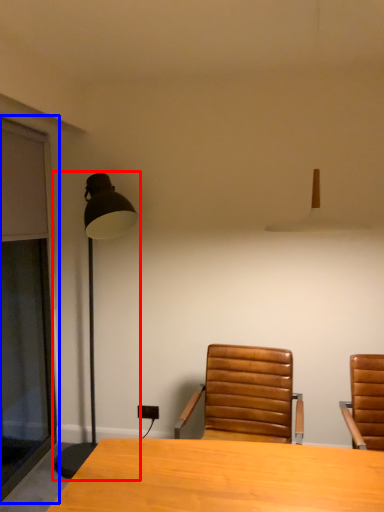
Question: Which of the following is the farthest to the observer, lamp (highlighted by a red box) or screen door (highlighted by a blue box)?

Choices:
 (A) lamp
 (B) screen door

Answer: (A)